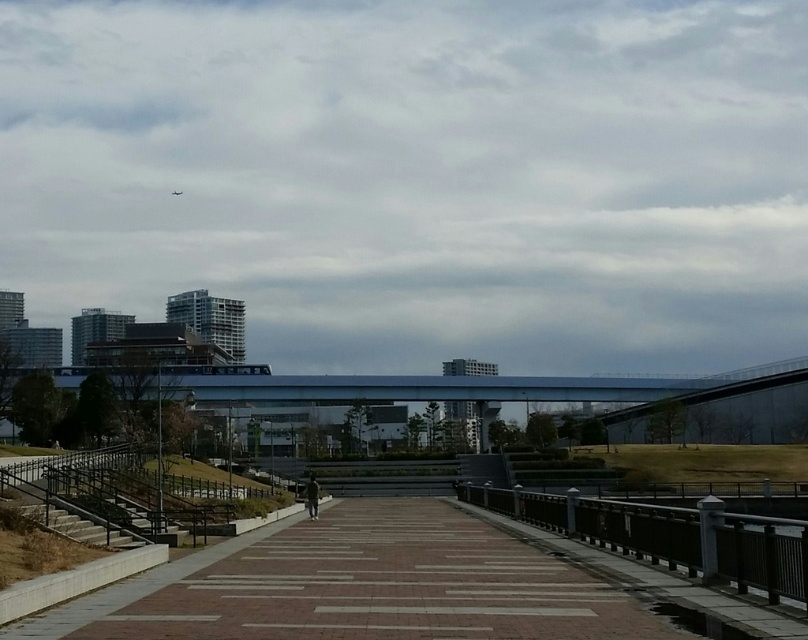
Is brick paved walkway at center wider than metallic gray railing at center?

Yes, brick paved walkway at center is wider than metallic gray railing at center.

Which is behind, point (327, 596) or point (713, 502)?

The point (713, 502) is more distant.

Image resolution: width=808 pixels, height=640 pixels. In order to click on brick paved walkway at center in this screenshot , I will do `click(385, 586)`.

Between point (417, 632) and point (663, 394), which one is positioned behind?

The point (663, 394) is more distant.

Can you confirm if brick paved walkway at center is positioned above blue glass pedestrian bridge at center?

Yes.

Who is more forward, (468,630) or (7,424)?

Point (468,630)

This screenshot has height=640, width=808. Identify the location of brick paved walkway at center. (385, 586).

Who is shorter, metallic gray railing at center or blue glass pedestrian bridge at center?

metallic gray railing at center is shorter.

Between metallic gray railing at center and blue glass pedestrian bridge at center, which one appears on the right side from the viewer's perspective?

blue glass pedestrian bridge at center is more to the right.

Which is in front, point (773, 548) or point (463, 396)?

Point (773, 548) is in front.

Image resolution: width=808 pixels, height=640 pixels. In order to click on metallic gray railing at center in this screenshot , I will do `click(667, 536)`.